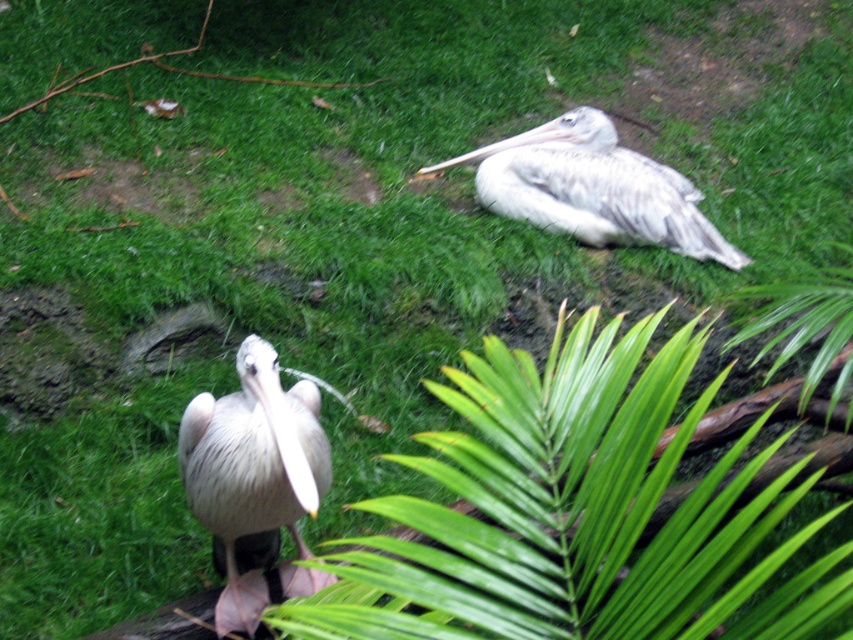
Question: Among these points, which one is nearest to the camera?

Choices:
 (A) (625, 243)
 (B) (306, 586)

Answer: (B)

Question: Among these objects, which one is farthest from the camera?

Choices:
 (A) white feathered pelican at upper right
 (B) white feathered pelican at center

Answer: (A)

Question: Is white feathered pelican at center further to the viewer compared to white feathered pelican at upper right?

Choices:
 (A) no
 (B) yes

Answer: (A)

Question: Which point is farther to the camera?

Choices:
 (A) (296, 420)
 (B) (527, 188)

Answer: (B)

Question: Is white feathered pelican at center smaller than white feathered pelican at upper right?

Choices:
 (A) yes
 (B) no

Answer: (A)

Question: Can you confirm if white feathered pelican at center is positioned above white feathered pelican at upper right?

Choices:
 (A) no
 (B) yes

Answer: (A)